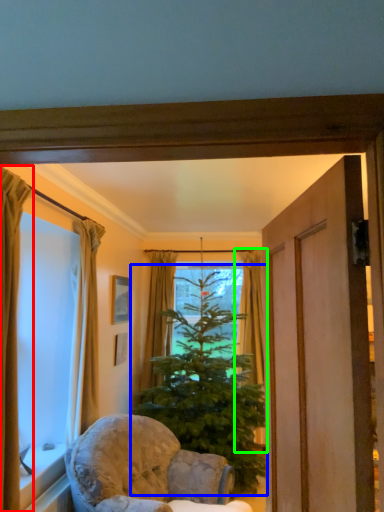
Question: Which is nearer to the curtain (highlighted by a red box)? christmas tree (highlighted by a blue box) or curtain (highlighted by a green box).

Choices:
 (A) christmas tree
 (B) curtain

Answer: (A)